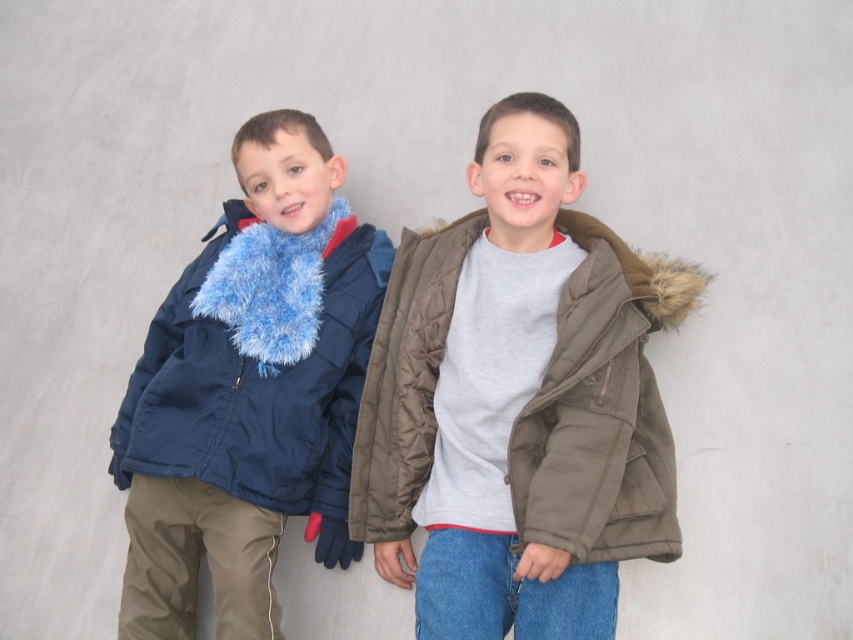
Does olive green quilted jacket at center appear on the left side of navy blue quilted jacket at left?

Incorrect, olive green quilted jacket at center is not on the left side of navy blue quilted jacket at left.

Consider the image. Which is below, olive green quilted jacket at center or navy blue quilted jacket at left?

olive green quilted jacket at center is lower down.

Measure the distance between olive green quilted jacket at center and camera.

The distance of olive green quilted jacket at center from camera is 2.29 meters.

Identify the location of olive green quilted jacket at center. (602, 408).